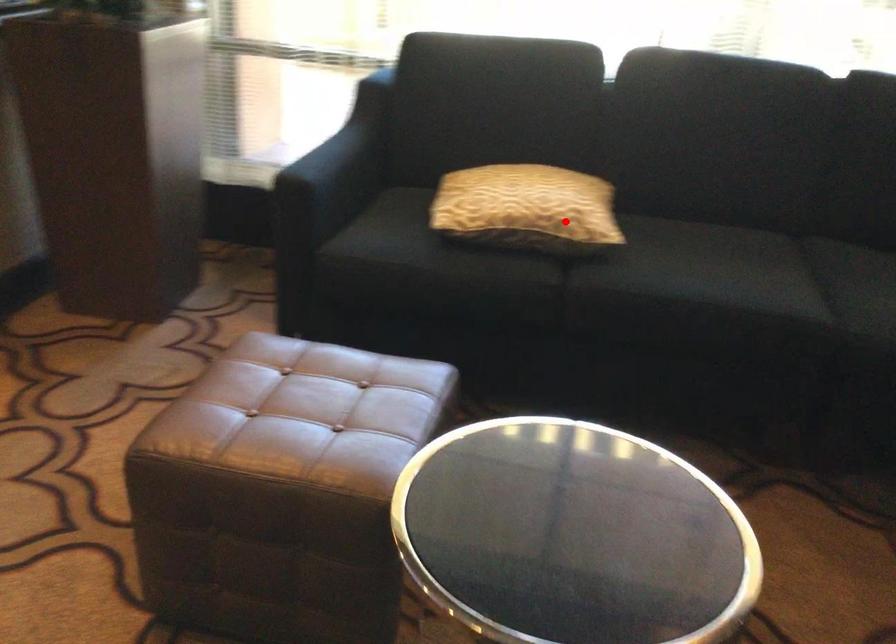
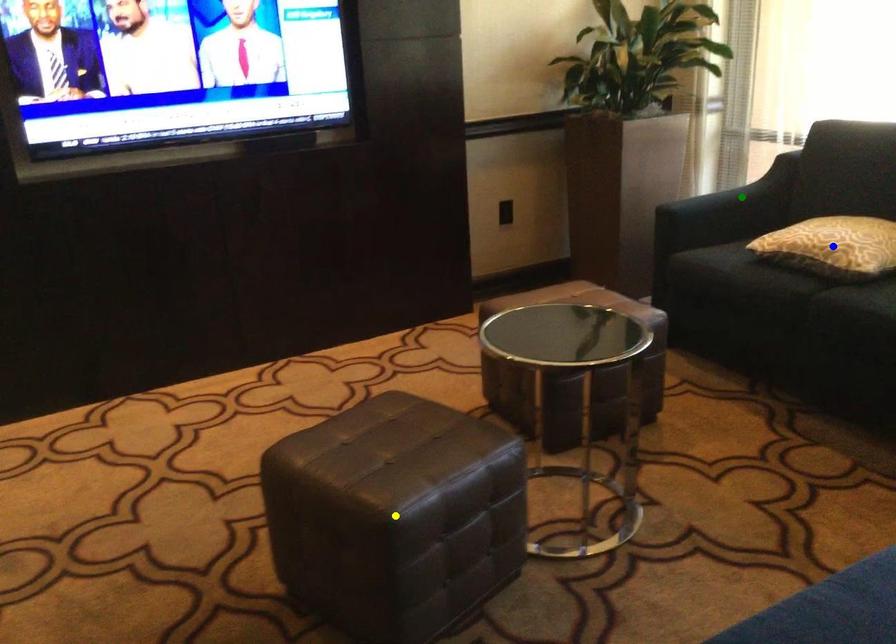
Question: I am providing you with two images of the same scene from different viewpoints. A red point is marked on the first image. You are given multiple points on the second image. In image 2, which mark is for the same physical point as the one in image 1?

Choices:
 (A) green point
 (B) yellow point
 (C) blue point

Answer: (C)